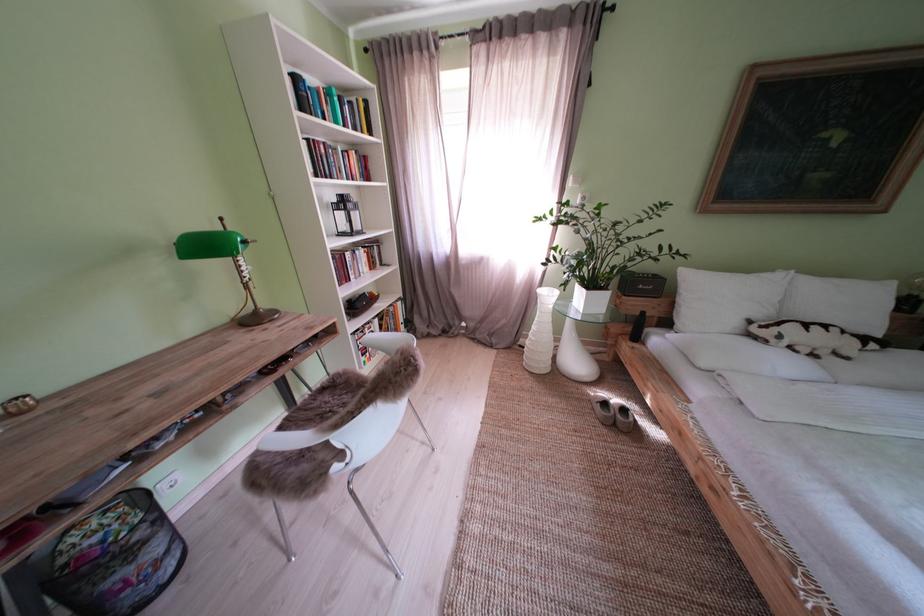
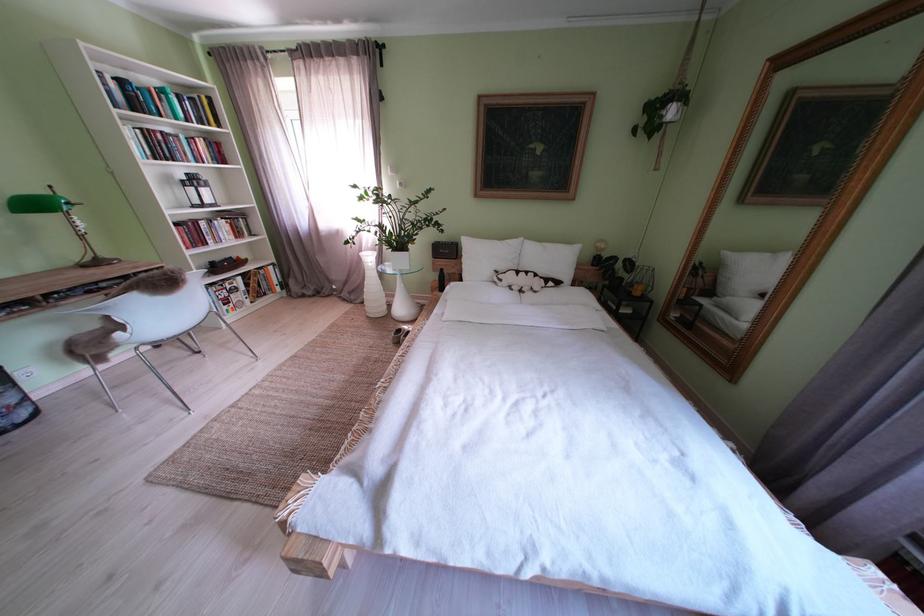
The point at (723, 304) is marked in the first image. Where is the corresponding point in the second image?

(490, 262)